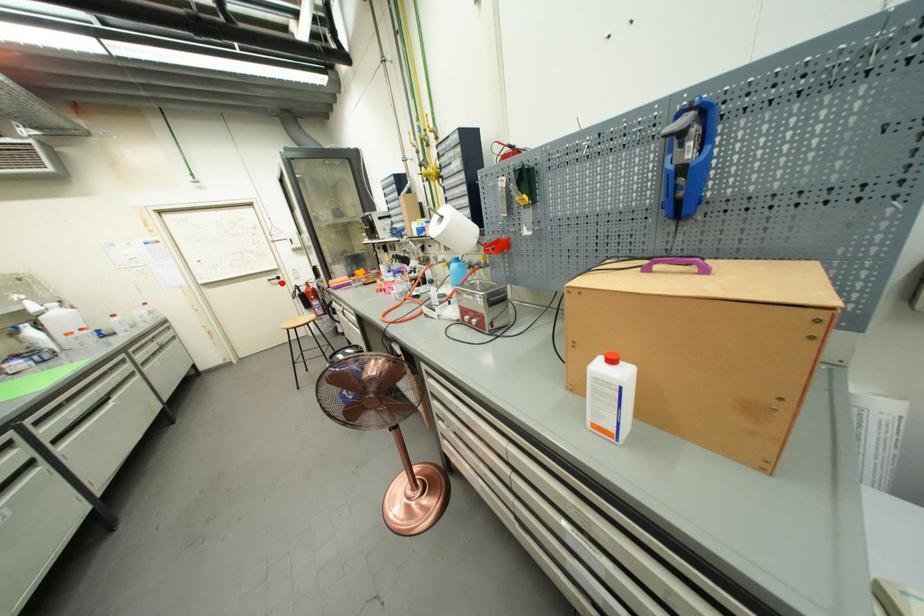
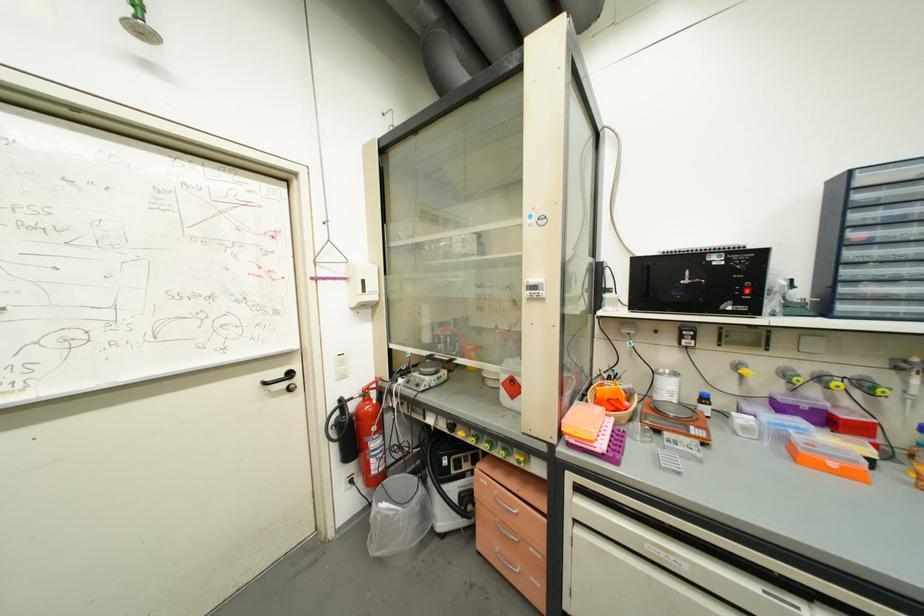
Question: I am providing you with two images of the same scene from different viewpoints. Image1 has a red point marked. In image2, the corresponding 3D location appears at what relative position? Reply with the corresponding letter.

Choices:
 (A) Closer
 (B) Farther

Answer: (B)